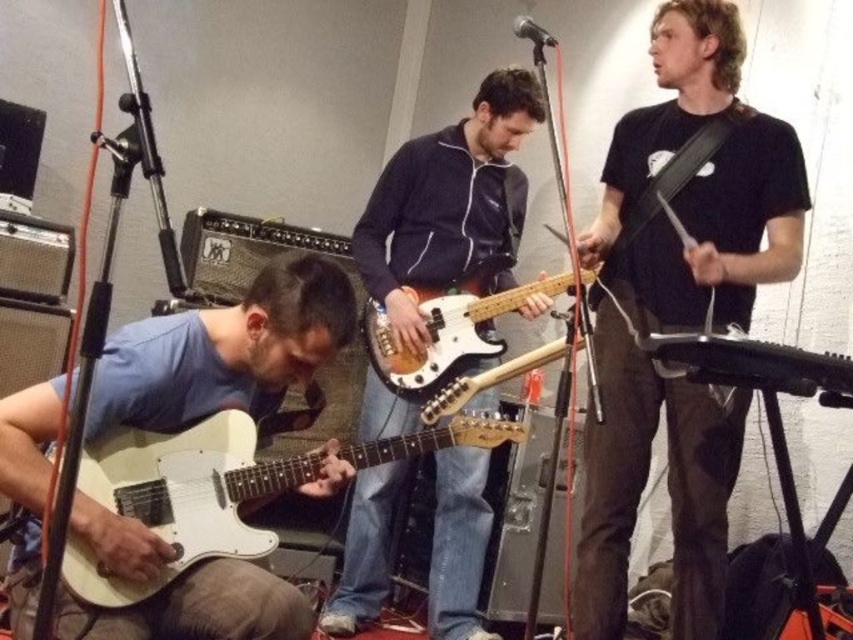
You are a photographer setting up a camera to capture the black matte guitar at center and the white matte electric guitar at lower left. Based on their positions, which guitar should you focus on first if you want to ensure both are in frame without moving the camera?

The black matte guitar at center is positioned over the white matte electric guitar at lower left, so focusing on the black matte guitar at center first will ensure both are in frame since it is in front.

You are a photographer setting up for a live music shoot. You need to position a spotlight so it illuminates both the white matte electric guitar at lower left and the wooden electric bass at center. Given their positions, which guitar should the spotlight be angled downward to reach?

The spotlight should be angled downward to reach the white matte electric guitar at lower left because it is located below the wooden electric bass at center.